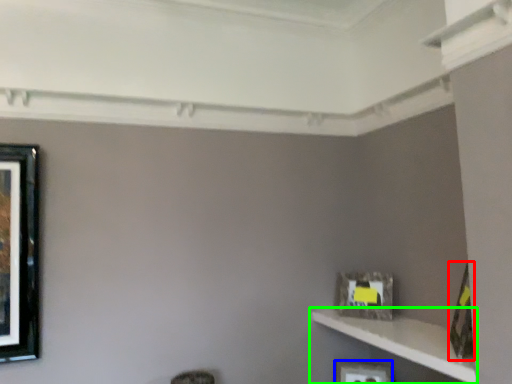
Question: Considering the real-world distances, which object is closest to picture frame (highlighted by a red box)? picture frame (highlighted by a blue box) or shelf (highlighted by a green box).

Choices:
 (A) picture frame
 (B) shelf

Answer: (B)